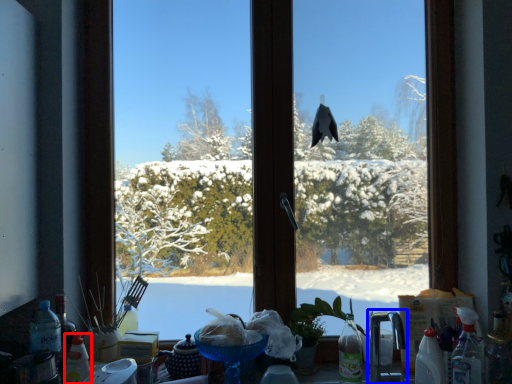
Question: Which object appears closest to the camera in this image, bottle (highlighted by a red box) or faucet (highlighted by a blue box)?

Choices:
 (A) bottle
 (B) faucet

Answer: (B)